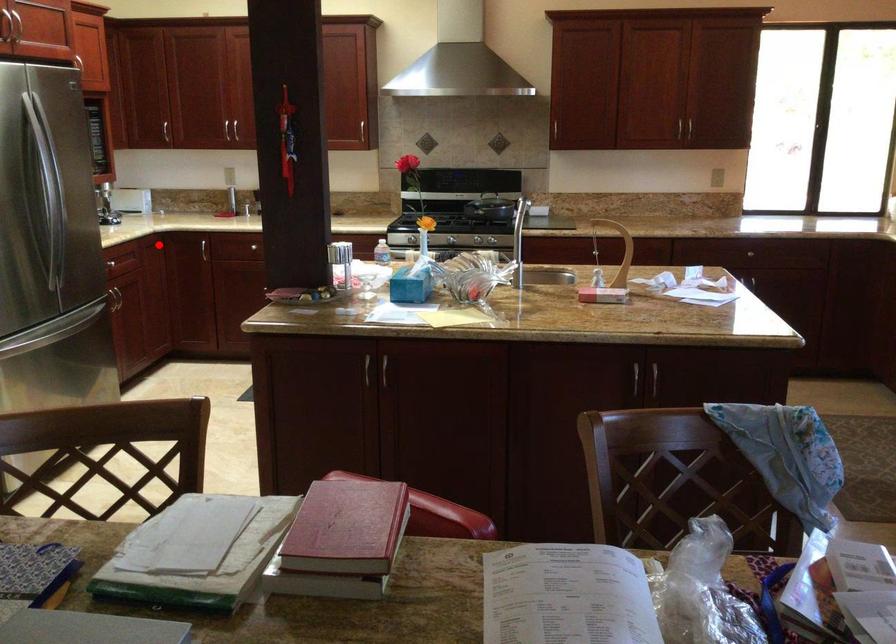
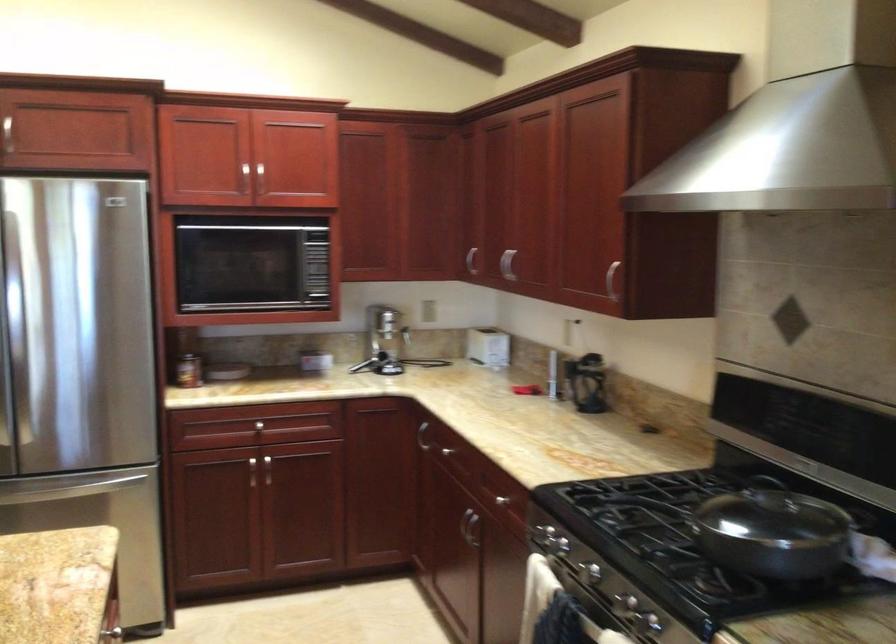
Where in the second image is the point corresponding to the highlighted location from the first image?

(421, 436)